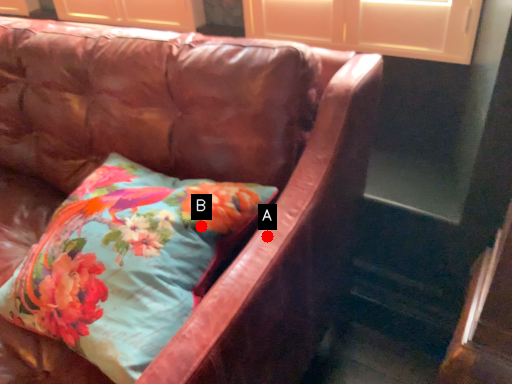
Question: Two points are circled on the image, labeled by A and B beside each circle. Which point appears farthest from the camera in this image?

Choices:
 (A) A is further
 (B) B is further

Answer: (B)